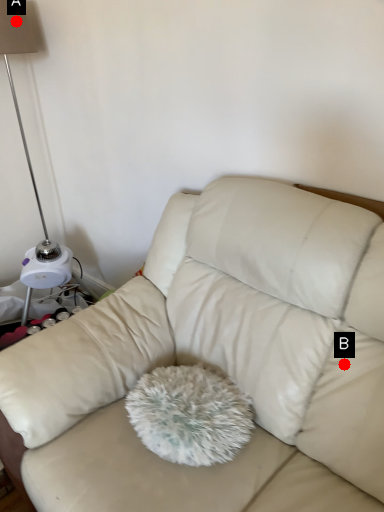
Question: Two points are circled on the image, labeled by A and B beside each circle. Which point is farther to the camera?

Choices:
 (A) A is further
 (B) B is further

Answer: (A)